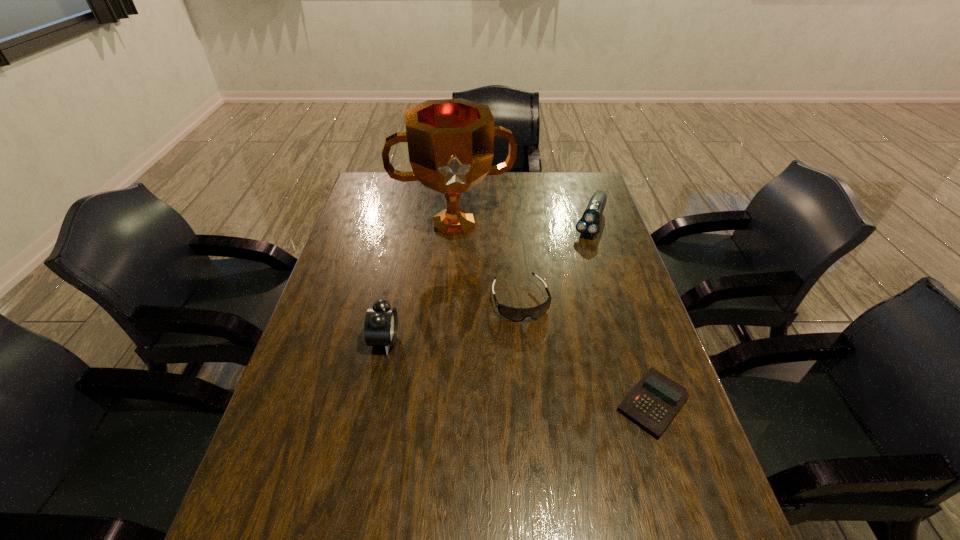
In the image, there is a desktop. At what (x,y) coordinates should I click in order to perform the action: click on free space at the far right corner. Please return your answer as a coordinate pair (x, y). Looking at the image, I should click on (571, 185).

Identify the location of free region at the near right corner. (686, 472).

Where is `blank region between the tallest object and the third farthest object`? blank region between the tallest object and the third farthest object is located at coordinates (487, 262).

The width and height of the screenshot is (960, 540). Find the location of `unoccupied position between the electric shaver and the tallest object`. unoccupied position between the electric shaver and the tallest object is located at coordinates (522, 223).

In order to click on vacant area that lies between the fourth farthest object and the third shortest object in this screenshot , I will do `click(488, 281)`.

This screenshot has width=960, height=540. Find the location of `free area in between the third farthest object and the second tallest object`. free area in between the third farthest object and the second tallest object is located at coordinates (452, 321).

Where is `unoccupied area between the electric shaver and the alarm clock`? The width and height of the screenshot is (960, 540). unoccupied area between the electric shaver and the alarm clock is located at coordinates tap(488, 281).

Identify the location of empty location between the tallest object and the fourth tallest object. The image size is (960, 540). (487, 262).

The width and height of the screenshot is (960, 540). Identify the location of free spot between the alarm clock and the electric shaver. (488, 281).

Where is `vacant space that is in between the alarm clock and the goggles`? The image size is (960, 540). vacant space that is in between the alarm clock and the goggles is located at coordinates (452, 321).